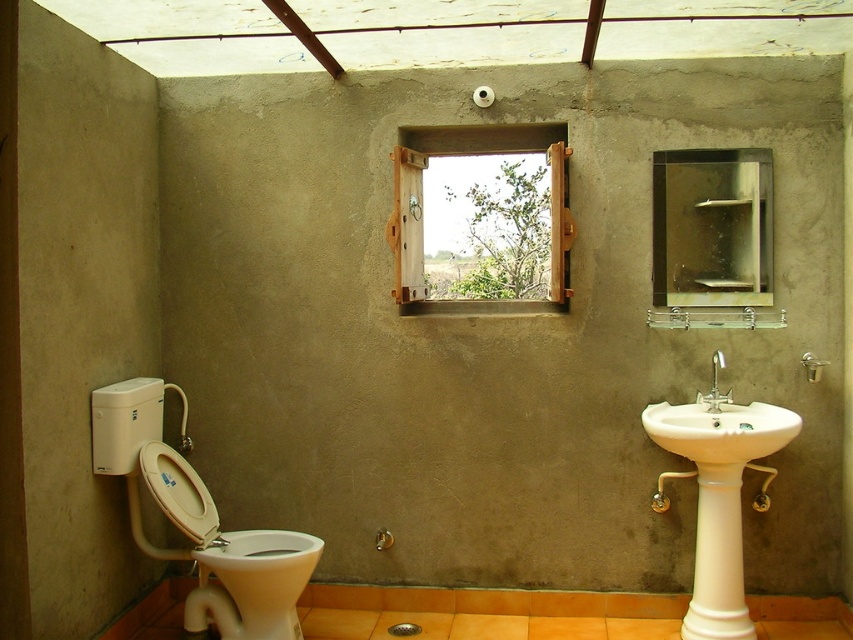
Question: Is wooden frame at center thinner than silver metallic faucet at sink right?

Choices:
 (A) no
 (B) yes

Answer: (A)

Question: Which point appears farthest from the camera in this image?

Choices:
 (A) (695, 403)
 (B) (288, 570)

Answer: (A)

Question: In this image, where is white ceramic sink at right located relative to silver metallic faucet at sink right?

Choices:
 (A) below
 (B) above

Answer: (A)

Question: Based on their relative distances, which object is farther from the wooden frame at center?

Choices:
 (A) silver metallic faucet at sink right
 (B) white ceramic sink at right
 (C) clear glass mirror at upper center

Answer: (A)

Question: Is white glossy bidet at lower left positioned at the back of white ceramic sink at right?

Choices:
 (A) yes
 (B) no

Answer: (B)

Question: Which of these objects is positioned farthest from the wooden frame at center?

Choices:
 (A) clear glass mirror at upper center
 (B) white glossy bidet at lower left
 (C) white ceramic sink at right

Answer: (B)